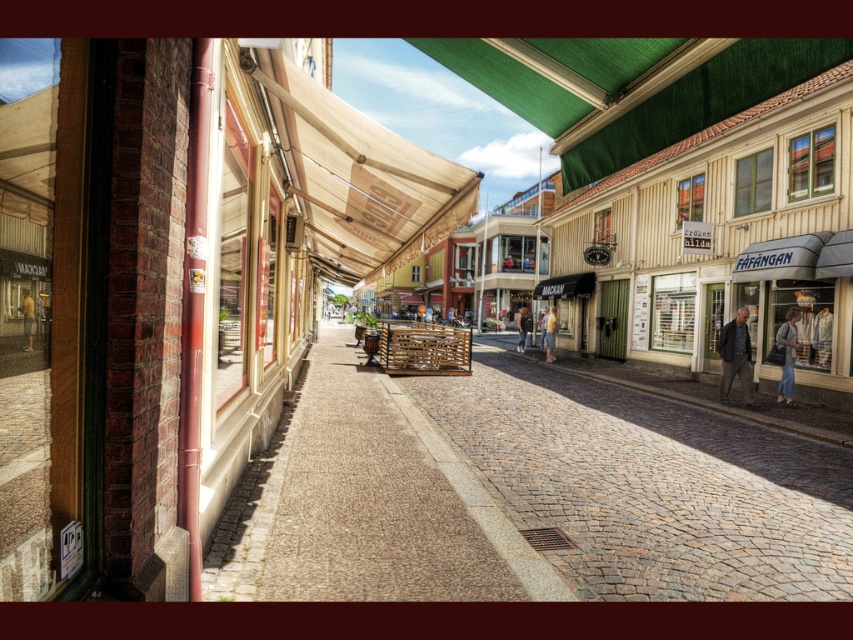
Question: Observing the image, what is the correct spatial positioning of dark gray suit at right in reference to blue jeans at lower right?

Choices:
 (A) above
 (B) below

Answer: (B)

Question: Which of the following is the closest to the observer?

Choices:
 (A) light blue denim jeans at center
 (B) light brown leather jacket at center

Answer: (A)

Question: Where is dark gray suit at right located in relation to yellow t-shirt at center in the image?

Choices:
 (A) right
 (B) left

Answer: (A)

Question: Does brown cobblestone at center have a larger size compared to blue jeans at lower right?

Choices:
 (A) no
 (B) yes

Answer: (B)

Question: Which point appears closest to the camera in this image?

Choices:
 (A) (654, 568)
 (B) (741, 314)
 (C) (793, 339)
 (D) (450, 189)

Answer: (A)

Question: Which point is farther to the camera?

Choices:
 (A) brown cobblestone at center
 (B) light brown leather jacket at center
 (C) yellow t-shirt at center

Answer: (B)